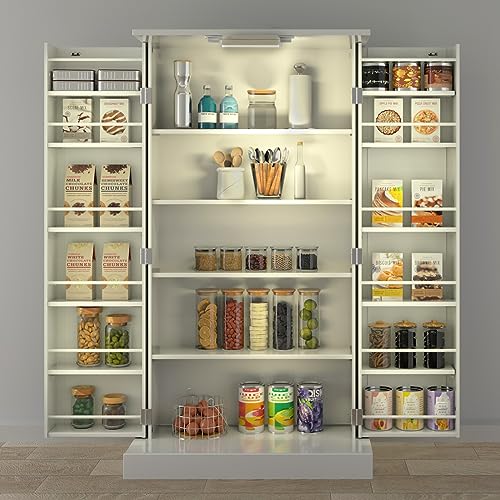
Where is `wooden spoons`? The image size is (500, 500). wooden spoons is located at coordinates (219, 158), (239, 151), (228, 161), (234, 161).